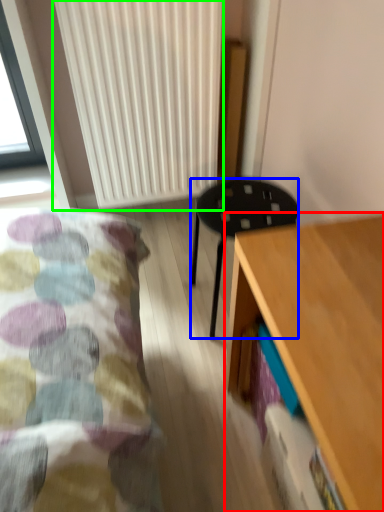
Question: Considering the real-world distances, which object is farthest from desk (highlighted by a red box)? stool (highlighted by a blue box) or radiator (highlighted by a green box)?

Choices:
 (A) stool
 (B) radiator

Answer: (B)